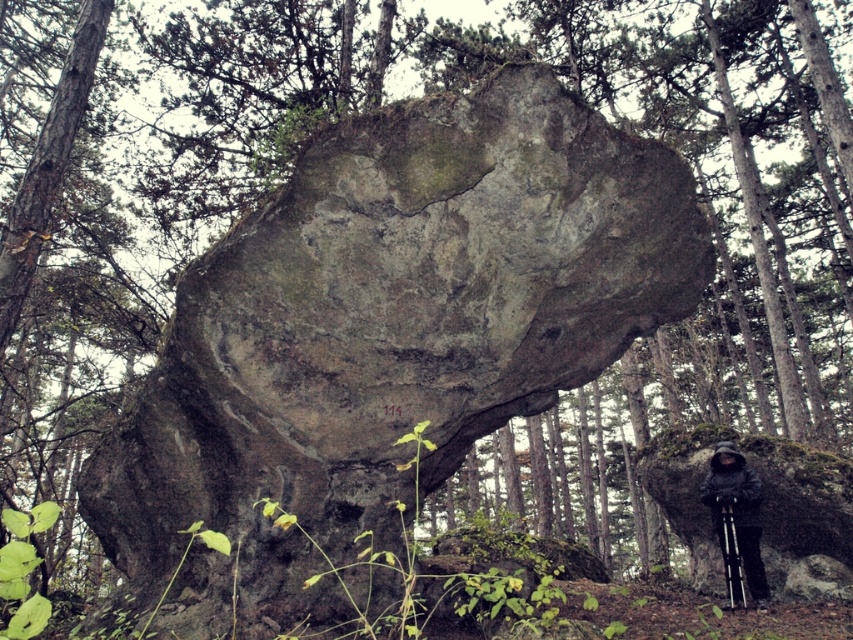
Between point (479, 278) and point (746, 512), which one is positioned behind?

The point (746, 512) is behind.

Describe the element at coordinates (390, 328) in the screenshot. I see `gray rough rock at center` at that location.

Which is in front, point (244, 332) or point (706, 493)?

Point (244, 332) is more forward.

Locate an element on the screen. The height and width of the screenshot is (640, 853). gray rough rock at center is located at coordinates (390, 328).